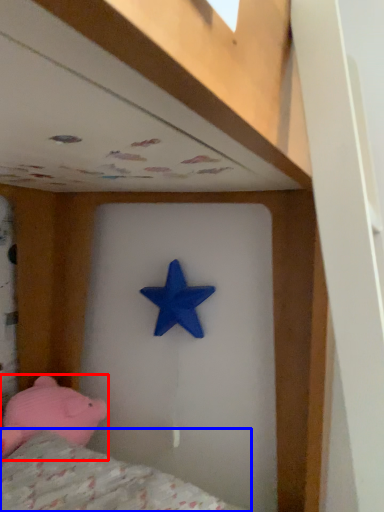
Question: Among these objects, which one is nearest to the camera, toy (highlighted by a red box) or mattress (highlighted by a blue box)?

Choices:
 (A) toy
 (B) mattress

Answer: (B)